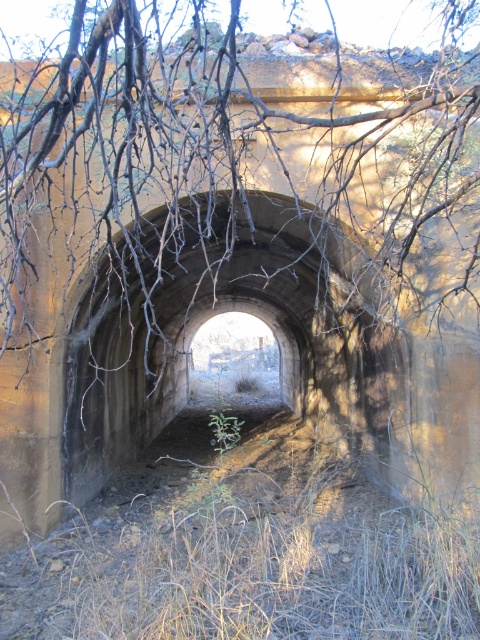
You are a hiker who wants to enter the tunnel. You notice brown dry branches at upper center and a green fuzzy plant at center. Which object is closer to the tunnel entrance?

The brown dry branches at upper center are positioned over the green fuzzy plant at center, meaning they are closer to the tunnel entrance than the plant.

You are a hiker planning to enter the concrete tunnel at center. As you approach, you notice the brown dry branches at upper center. From your perspective, which side of the tunnel entrance do the branches appear to be on?

The brown dry branches at upper center are positioned on the right side of the concrete tunnel at center, so they appear on the right side of the tunnel entrance from your perspective.